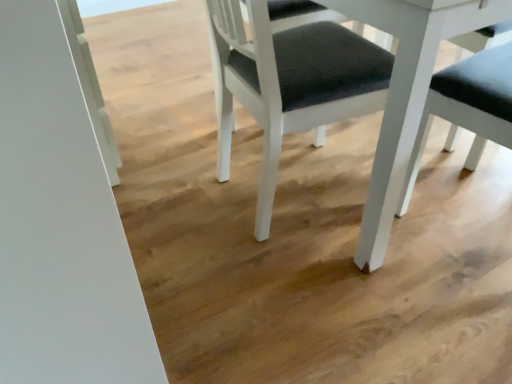
The width and height of the screenshot is (512, 384). Describe the element at coordinates (406, 94) in the screenshot. I see `white matte table at center` at that location.

The width and height of the screenshot is (512, 384). I want to click on white matte table at center, so click(x=406, y=94).

The image size is (512, 384). What do you see at coordinates (289, 78) in the screenshot?
I see `white matte chair at center` at bounding box center [289, 78].

This screenshot has width=512, height=384. What are the coordinates of `white matte chair at center` in the screenshot? It's located at (289, 78).

Where is `white matte table at center`? The image size is (512, 384). white matte table at center is located at coordinates (406, 94).

Is white matte table at center to the left of white matte chair at center from the viewer's perspective?

Incorrect, white matte table at center is not on the left side of white matte chair at center.

Relative to white matte chair at center, is white matte table at center in front or behind?

In the image, white matte table at center appears in front of white matte chair at center.

Is point (416, 55) closer to camera compared to point (313, 117)?

That is True.

From the image's perspective, is white matte table at center over white matte chair at center?

Yes, from the image's perspective, white matte table at center is over white matte chair at center.

From a real-world perspective, which object stands above the other?

white matte table at center is physically above.

Which of these two, white matte table at center or white matte chair at center, is thinner?

white matte chair at center.

Does white matte table at center have a greater height compared to white matte chair at center?

Correct, white matte table at center is much taller as white matte chair at center.

Does white matte table at center have a smaller size compared to white matte chair at center?

Incorrect, white matte table at center is not smaller in size than white matte chair at center.

Would you say white matte table at center contains white matte chair at center?

Yes, white matte table at center contains white matte chair at center.

Is white matte table at center touching white matte chair at center?

white matte table at center is not next to white matte chair at center, and they're not touching.

Is white matte table at center facing towards white matte chair at center?

Yes, white matte table at center is aimed at white matte chair at center.

Where is `chair on the left of the white matte table at center`? The height and width of the screenshot is (384, 512). chair on the left of the white matte table at center is located at coordinates (289, 78).

Visually, is white matte chair at center positioned to the left or to the right of white matte table at center?

From the image, it's evident that white matte chair at center is to the left of white matte table at center.

Is the depth of white matte chair at center greater than that of white matte table at center?

Yes, it is.

Is point (245, 62) in front of point (420, 75)?

No, it is behind (420, 75).

From the image's perspective, is white matte chair at center located above or below white matte table at center?

Based on their image positions, white matte chair at center is located beneath white matte table at center.

From a real-world perspective, is white matte chair at center positioned above or below white matte table at center?

white matte chair at center is below white matte table at center.

Which of these two, white matte chair at center or white matte table at center, is thinner?

With smaller width is white matte chair at center.

From the picture: Considering the sizes of white matte chair at center and white matte table at center in the image, is white matte chair at center taller or shorter than white matte table at center?

Clearly, white matte chair at center is shorter compared to white matte table at center.

Is white matte chair at center bigger or smaller than white matte table at center?

In the image, white matte chair at center appears to be smaller than white matte table at center.

Could white matte table at center be considered to be inside white matte chair at center?

No, white matte table at center is not inside white matte chair at center.

Is white matte chair at center next to white matte table at center?

No, white matte chair at center is not with white matte table at center.

Consider the image. Is white matte chair at center facing towards white matte table at center?

Yes, white matte chair at center is facing white matte table at center.

Identify the location of chair that is on the left side of white matte table at center. This screenshot has height=384, width=512. (289, 78).

Image resolution: width=512 pixels, height=384 pixels. In order to click on chair below the white matte table at center (from a real-world perspective) in this screenshot , I will do `click(289, 78)`.

This screenshot has width=512, height=384. Identify the location of chair on the left of the white matte table at center. (289, 78).